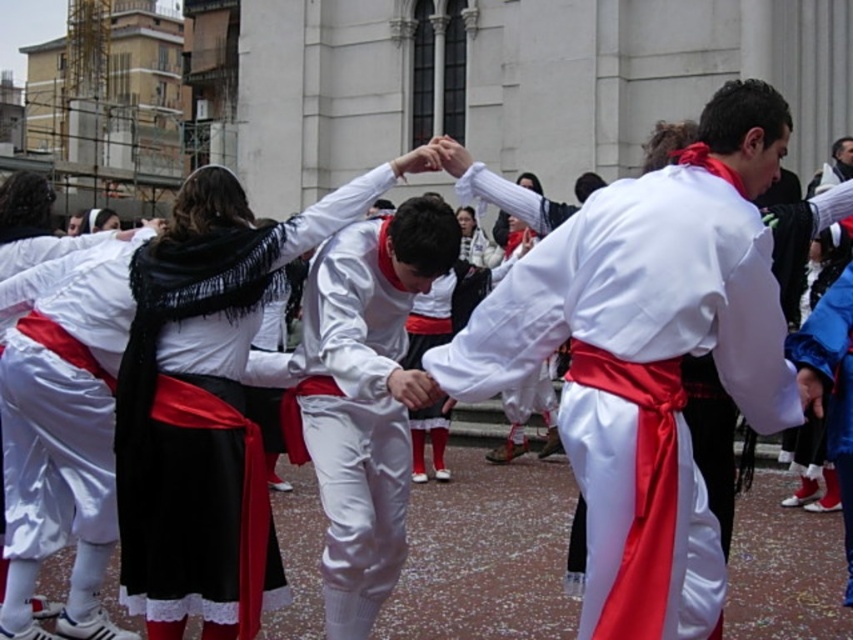
Does point (567, 397) come farther from viewer compared to point (160, 339)?

No, (567, 397) is in front of (160, 339).

Based on the photo, how distant is satin white robe at center from matte black robe at center?

The distance of satin white robe at center from matte black robe at center is 7.46 meters.

Between point (595, 250) and point (247, 301), which one is positioned behind?

The point (247, 301) is behind.

Find the location of a particular element. The width and height of the screenshot is (853, 640). satin white robe at center is located at coordinates (639, 294).

Does point (131, 280) come farther from viewer compared to point (352, 426)?

No, (131, 280) is closer to viewer.

Is matte black robe at center wider than white satin pants at center?

Yes, matte black robe at center is wider than white satin pants at center.

Image resolution: width=853 pixels, height=640 pixels. I want to click on matte black robe at center, so click(x=206, y=404).

What are the coordinates of `matte black robe at center` in the screenshot? It's located at (206, 404).

Which is more to the left, satin white robe at center or white satin pants at center?

white satin pants at center

Does satin white robe at center come in front of white satin pants at center?

Yes, satin white robe at center is closer to the viewer.

Is point (720, 230) positioned behind point (380, 472)?

No, (720, 230) is in front of (380, 472).

Image resolution: width=853 pixels, height=640 pixels. I want to click on satin white robe at center, so click(x=639, y=294).